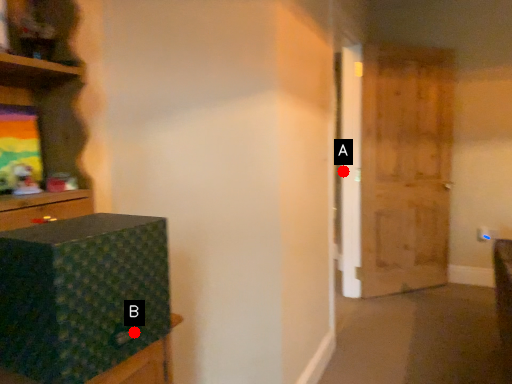
Question: Two points are circled on the image, labeled by A and B beside each circle. Among these points, which one is farthest from the camera?

Choices:
 (A) A is further
 (B) B is further

Answer: (A)